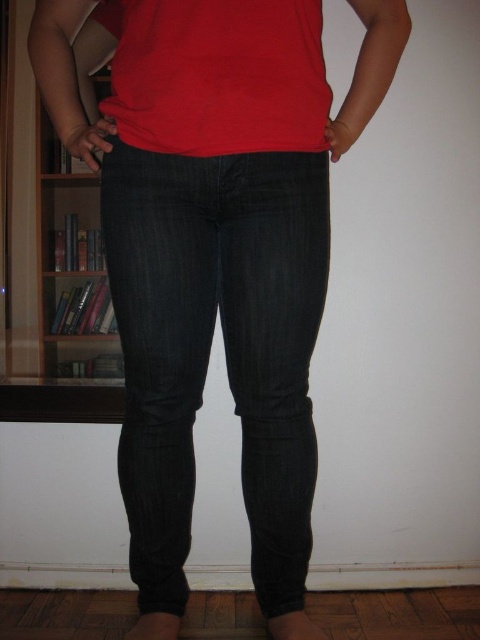
Who is higher up, dark blue denim jeans at center or matte red t-shirt at center?

Positioned higher is matte red t-shirt at center.

The width and height of the screenshot is (480, 640). What do you see at coordinates (210, 348) in the screenshot? I see `dark blue denim jeans at center` at bounding box center [210, 348].

Is point (235, 205) positioned behind point (298, 131)?

Yes, it is behind point (298, 131).

In order to click on dark blue denim jeans at center in this screenshot , I will do `click(210, 348)`.

How distant is dark blue denim jeans at center from wooden bookshelf at left?

They are 17.18 inches apart.

Between dark blue denim jeans at center and wooden bookshelf at left, which one is positioned higher?

Positioned higher is wooden bookshelf at left.

Find the location of `dark blue denim jeans at center`. dark blue denim jeans at center is located at coordinates (210, 348).

Image resolution: width=480 pixels, height=640 pixels. Describe the element at coordinates (216, 74) in the screenshot. I see `matte red t-shirt at center` at that location.

Can you confirm if matte red t-shirt at center is positioned below wooden bookshelf at left?

Actually, matte red t-shirt at center is above wooden bookshelf at left.

Where is `matte red t-shirt at center`? The width and height of the screenshot is (480, 640). matte red t-shirt at center is located at coordinates (216, 74).